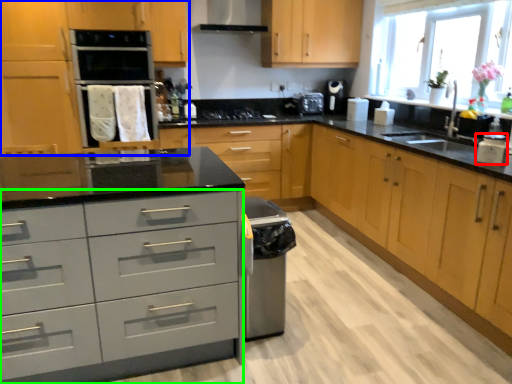
Question: Considering the real-world distances, which object is closest to kitchen appliance (highlighted by a red box)? cabinetry (highlighted by a blue box) or drawer (highlighted by a green box).

Choices:
 (A) cabinetry
 (B) drawer

Answer: (B)